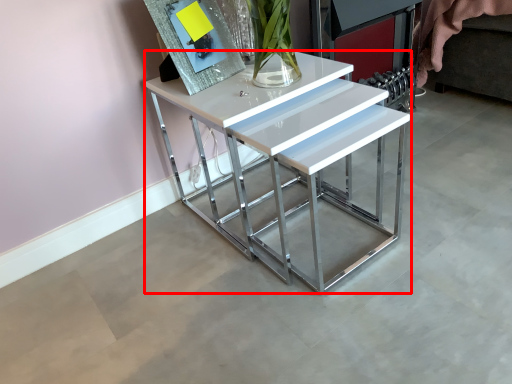
Question: From the image's perspective, where is table (annotated by the red box) located relative to picture frame?

Choices:
 (A) below
 (B) above

Answer: (A)